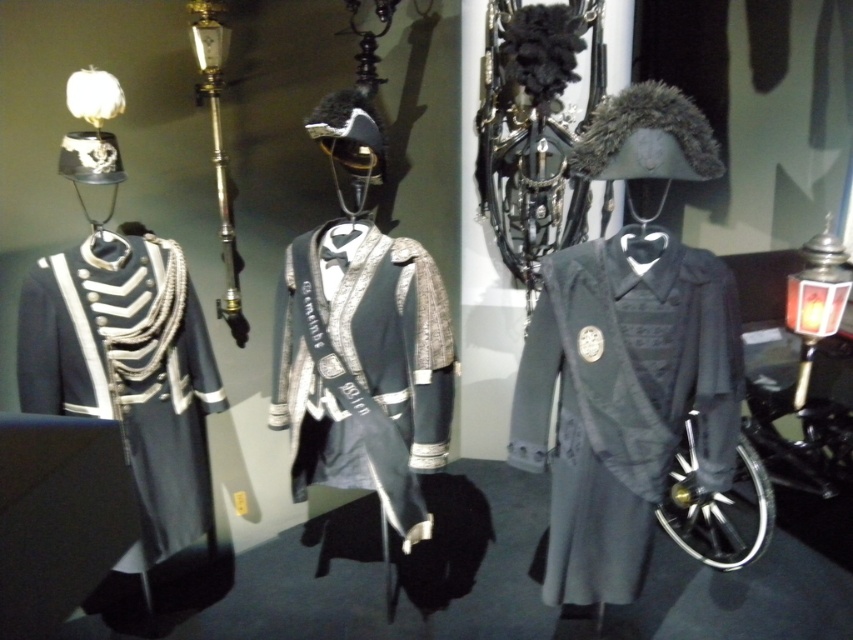
Can you confirm if matte black coat at center is positioned to the left of shiny silver jacket at center?

Incorrect, matte black coat at center is not on the left side of shiny silver jacket at center.

Based on the photo, can you confirm if matte black coat at center is bigger than shiny silver jacket at center?

Actually, matte black coat at center might be smaller than shiny silver jacket at center.

Locate an element on the screen. The width and height of the screenshot is (853, 640). matte black coat at center is located at coordinates (624, 397).

Identify the location of matte black coat at center. (624, 397).